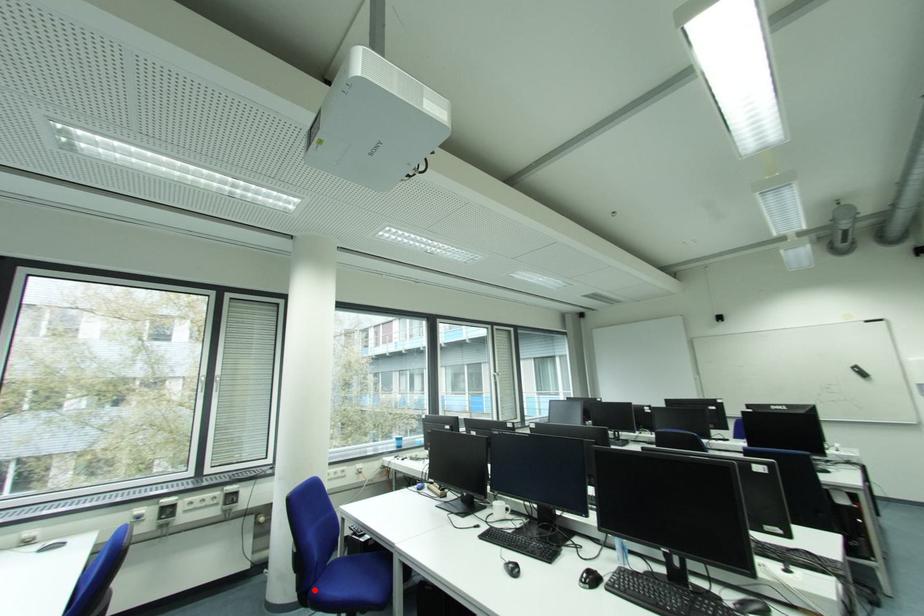
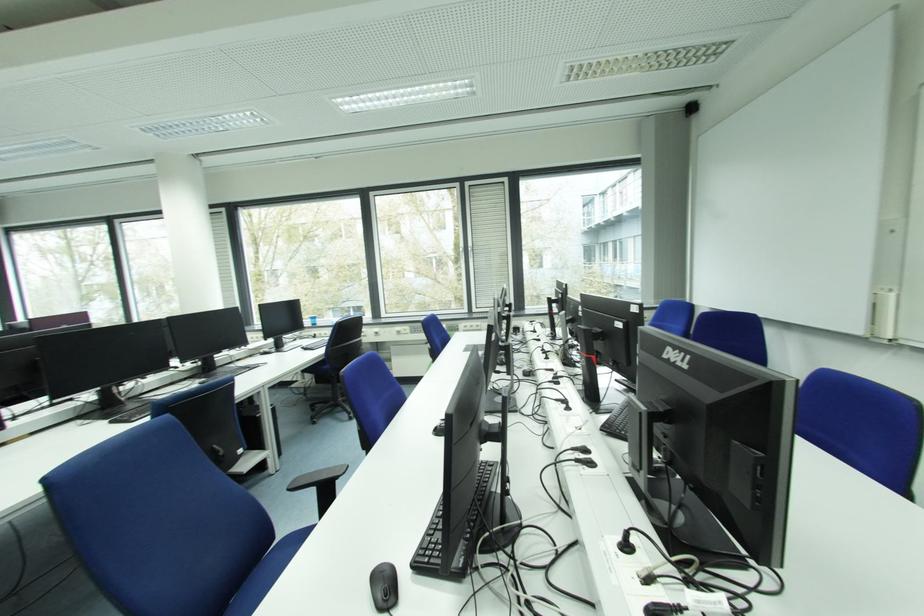
Question: I am providing you with two images of the same scene from different viewpoints. A red point is marked on the first image. Can you still see the location of the red point in image 2?

Choices:
 (A) Yes
 (B) No

Answer: (B)